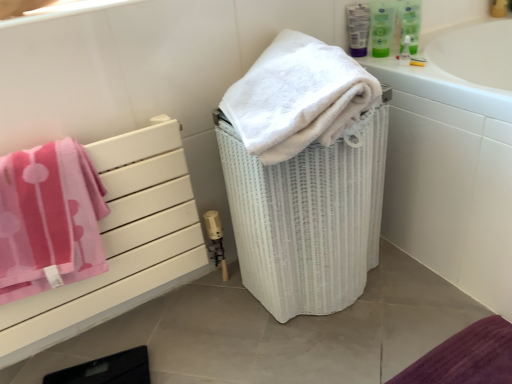
Where is `vacant space underneath pink fabric towel at left (from a real-world perspective)`? This screenshot has height=384, width=512. vacant space underneath pink fabric towel at left (from a real-world perspective) is located at coordinates (123, 317).